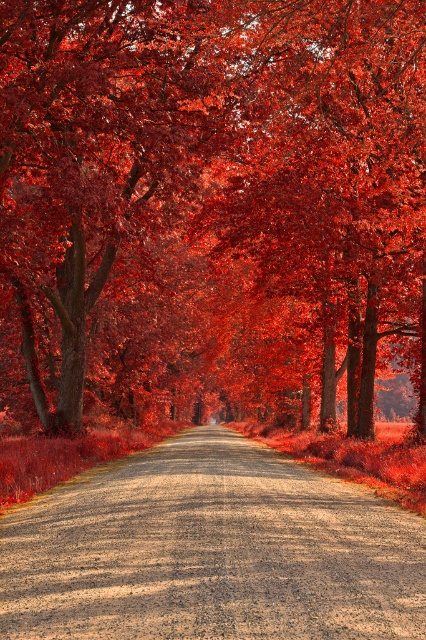
Is smooth bark tree at center above dirt/gravel road at center?

Yes, smooth bark tree at center is above dirt/gravel road at center.

Is smooth bark tree at center behind dirt/gravel road at center?

Yes, it is.

Is point (86, 317) positioned behind point (212, 486)?

Yes, it is behind point (212, 486).

I want to click on smooth bark tree at center, so click(x=210, y=209).